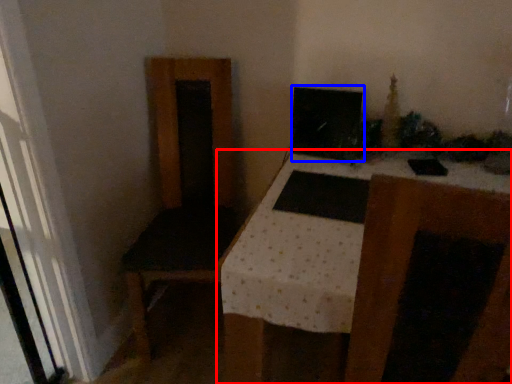
Question: Which object is further to the camera taking this photo, table (highlighted by a red box) or computer monitor (highlighted by a blue box)?

Choices:
 (A) table
 (B) computer monitor

Answer: (B)